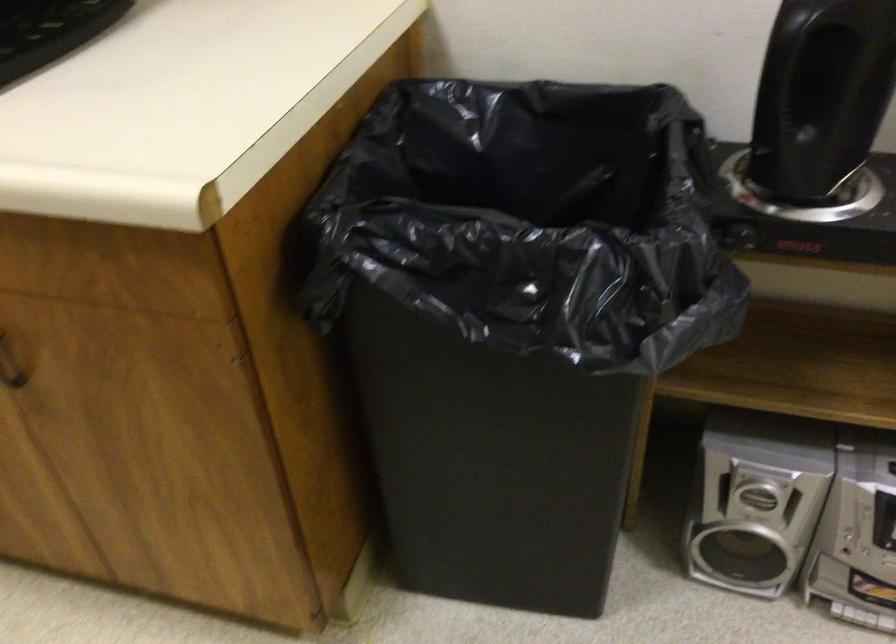
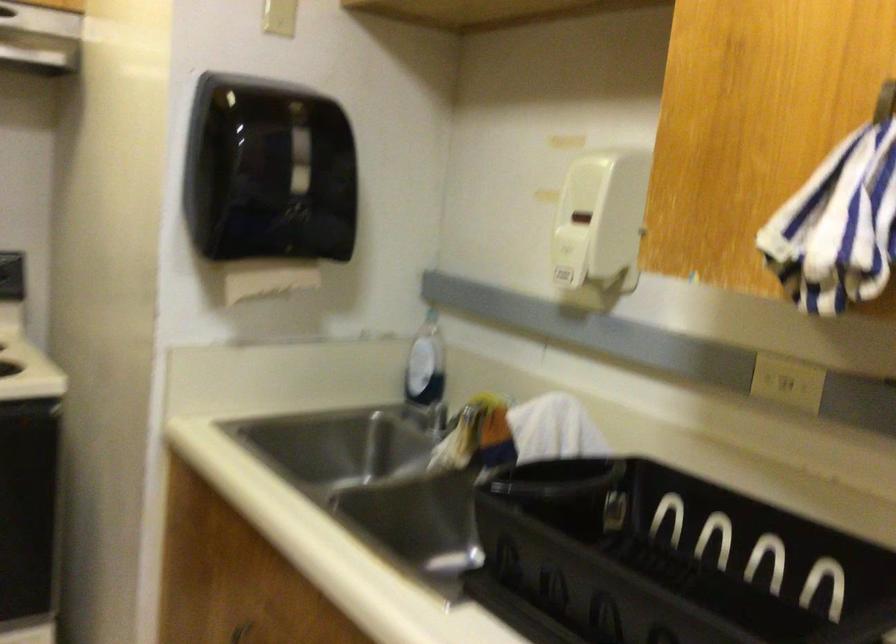
First-person continuous shooting, in which direction is the camera rotating?

The camera's rotation is toward left-up.